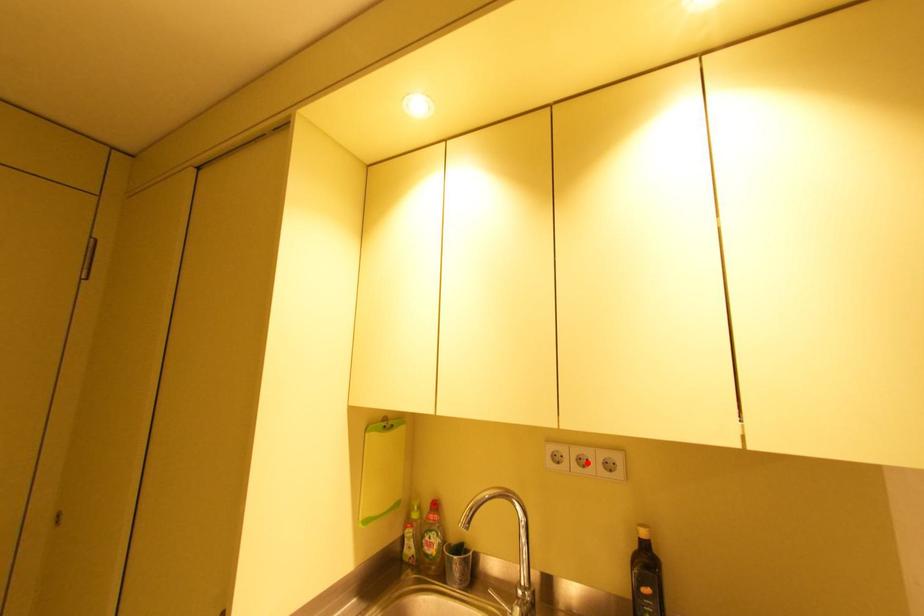
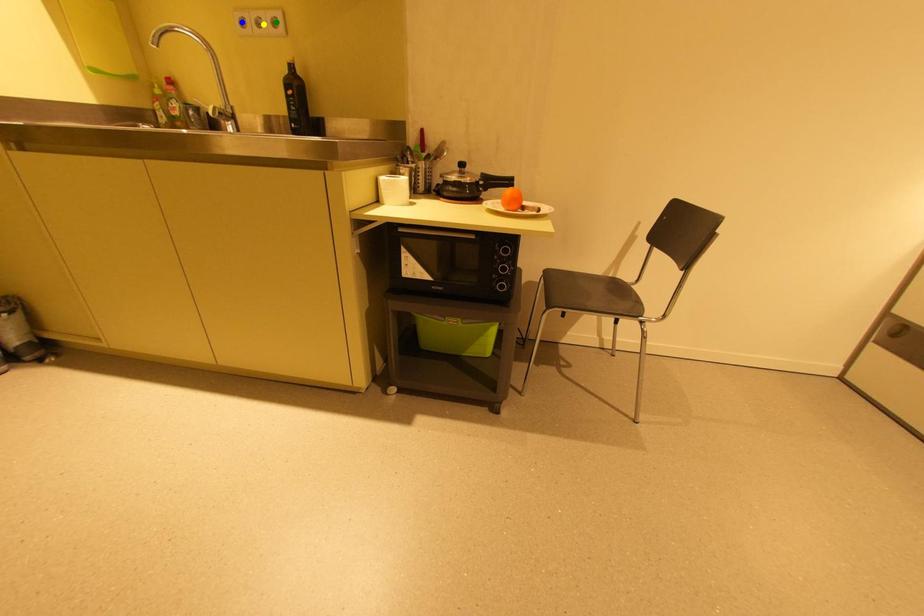
Question: I am providing you with two images of the same scene from different viewpoints. A red point is marked on the first image. You are given multiple points on the second image. In image 2, which mark is for the same physical point as the one in image 1?

Choices:
 (A) blue point
 (B) green point
 (C) yellow point

Answer: (C)